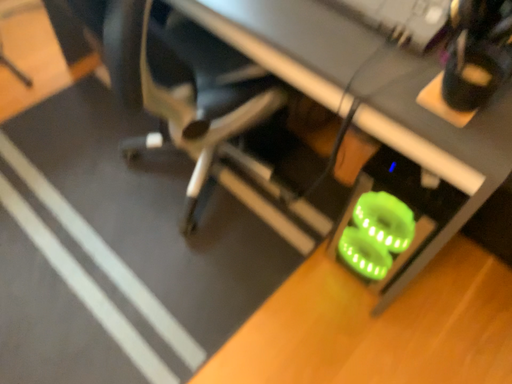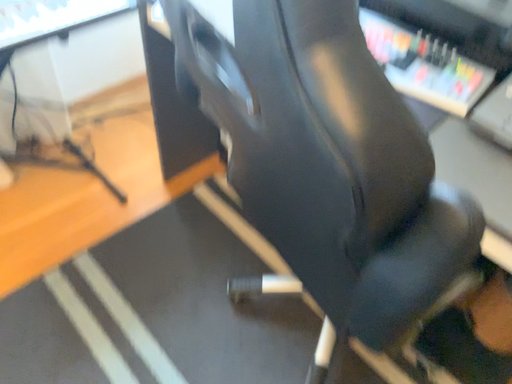
Question: How did the camera likely rotate when shooting the video?

Choices:
 (A) rotated downward
 (B) rotated upward

Answer: (B)